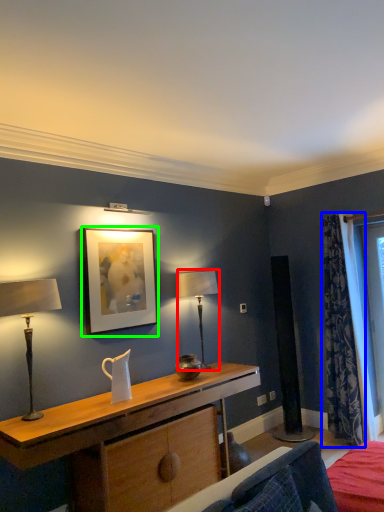
Question: Based on their relative distances, which object is farther from table lamp (highlighted by a red box)? Choose from curtain (highlighted by a blue box) and picture frame (highlighted by a green box).

Choices:
 (A) curtain
 (B) picture frame

Answer: (A)